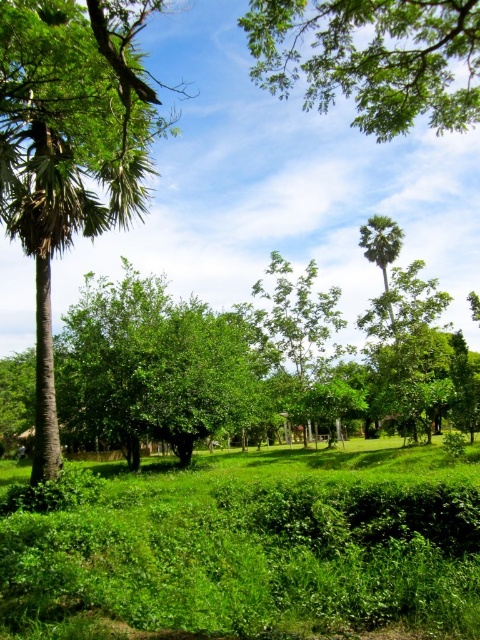
Can you confirm if green grass at center is shorter than green leafy tree at upper center?

Correct, green grass at center is not as tall as green leafy tree at upper center.

Which is behind, point (61, 504) or point (367, 83)?

The point (367, 83) is more distant.

You are a GUI agent. You are given a task and a screenshot of the screen. Output one action in this format:
    pyautogui.click(x=<x>, y=<y>)
    Task: Click on the green grass at center
    
    Given the screenshot: What is the action you would take?
    pyautogui.click(x=253, y=548)

Based on the photo, is green leafy tree at upper center in front of green leafy palm at upper center?

Yes, green leafy tree at upper center is closer to the viewer.

Is green leafy tree at upper center taller than green leafy palm at upper center?

Correct, green leafy tree at upper center is much taller as green leafy palm at upper center.

The width and height of the screenshot is (480, 640). Identify the location of green leafy tree at upper center. (372, 58).

Measure the distance between green grass at center and green leafy palm at upper center.

The distance of green grass at center from green leafy palm at upper center is 15.47 meters.

Who is lower down, green grass at center or green leafy palm at upper center?

Positioned lower is green grass at center.

Between point (268, 493) and point (379, 244), which one is positioned behind?

The point (379, 244) is more distant.

Identify the location of green grass at center. (253, 548).